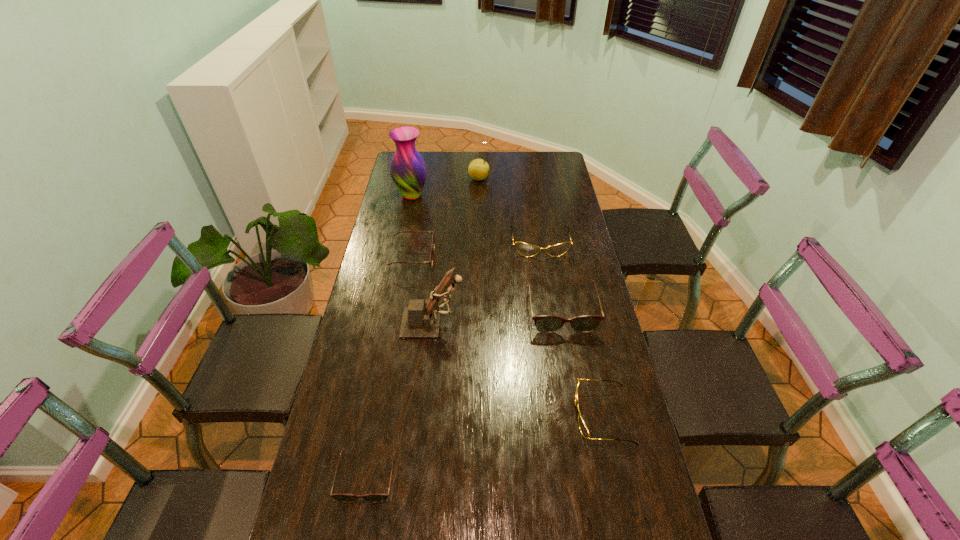
Where is `free location located 0.340m on the front-facing side of the fourth farthest spectacles`? This screenshot has height=540, width=960. free location located 0.340m on the front-facing side of the fourth farthest spectacles is located at coordinates (452, 415).

Identify the location of free spot located on the front-facing side of the fourth farthest spectacles. (495, 415).

Image resolution: width=960 pixels, height=540 pixels. I want to click on free space located 0.130m on the front-facing side of the fourth farthest spectacles, so click(528, 415).

Image resolution: width=960 pixels, height=540 pixels. Find the location of `vacant space located 0.070m at the front view of the nearest brown spectacles`. vacant space located 0.070m at the front view of the nearest brown spectacles is located at coordinates (357, 536).

Image resolution: width=960 pixels, height=540 pixels. Find the location of `object positioned at the far edge`. object positioned at the far edge is located at coordinates (478, 169).

At what (x,y) coordinates should I click in order to perform the action: click on vase that is at the left edge. Please return your answer as a coordinate pair (x, y). The width and height of the screenshot is (960, 540). Looking at the image, I should click on (408, 170).

Find the location of a particular element. figurine located in the left edge section of the desktop is located at coordinates (421, 319).

I want to click on free space at the left edge, so [x=362, y=380].

The width and height of the screenshot is (960, 540). Identify the location of vacant space at the right edge. (563, 257).

Locate an element on the screen. The height and width of the screenshot is (540, 960). blank space at the far right corner is located at coordinates (551, 152).